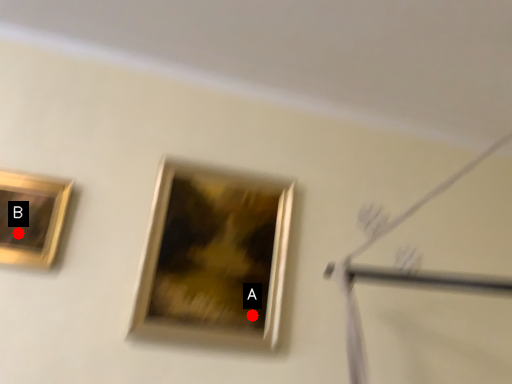
Question: Two points are circled on the image, labeled by A and B beside each circle. Which of the following is the farthest from the observer?

Choices:
 (A) A is further
 (B) B is further

Answer: (A)